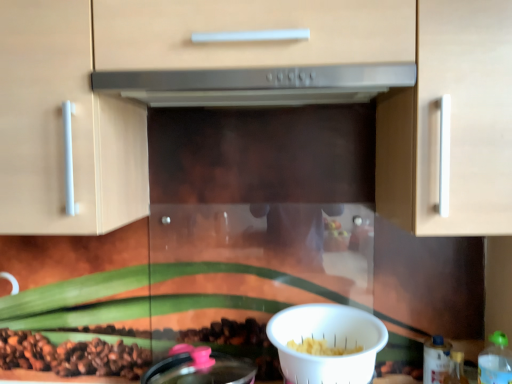
At what (x,y) coordinates should I click in order to perform the action: click on satin silver range hood at center. Please return your answer as a coordinate pair (x, y). The height and width of the screenshot is (384, 512). Looking at the image, I should click on (257, 85).

This screenshot has height=384, width=512. What are the coordinates of `translucent plastic bottle at lower right, placed as the second bottle when sorted from front to back` in the screenshot? It's located at (456, 369).

Is green plastic bottle at lower right, which is counted as the 1th bottle, starting from the front, positioned far away from satin silver range hood at center?

green plastic bottle at lower right, which is counted as the 1th bottle, starting from the front, is actually quite close to satin silver range hood at center.

Is point (498, 353) less distant than point (141, 94)?

That is False.

From the image's perspective, is green plastic bottle at lower right, which is counted as the 1th bottle, starting from the front, on top of satin silver range hood at center?

Actually, green plastic bottle at lower right, which is counted as the 1th bottle, starting from the front, appears below satin silver range hood at center in the image.

Can you see satin silver range hood at center touching translucent plastic bottle at lower right, which is counted as the second bottle, starting from the back?

No, satin silver range hood at center is not with translucent plastic bottle at lower right, which is counted as the second bottle, starting from the back.

From the satin silver range hood at center, count 2nd bottles backward and point to it. Please provide its 2D coordinates.

[(456, 369)]

Who is more distant, satin silver range hood at center or translucent plastic bottle at lower right, placed as the second bottle when sorted from front to back?

translucent plastic bottle at lower right, placed as the second bottle when sorted from front to back, is behind.

From a real-world perspective, relative to translucent plastic bottle at lower right, placed as the second bottle when sorted from front to back, is satin silver range hood at center vertically above or below?

In terms of real-world spatial position, satin silver range hood at center is above translucent plastic bottle at lower right, placed as the second bottle when sorted from front to back.

Does point (370, 86) come closer to viewer compared to point (291, 377)?

Yes.

Does satin silver range hood at center have a greater height compared to white plastic bowl at lower center?

Incorrect, the height of satin silver range hood at center is not larger of that of white plastic bowl at lower center.

Is satin silver range hood at center turned away from white plastic bowl at lower center?

No, white plastic bowl at lower center is not at the back of satin silver range hood at center.

Find the location of `cabinetry on the left of translucent plastic bottle at lower right, placed as the second bottle when sorted from front to back`. cabinetry on the left of translucent plastic bottle at lower right, placed as the second bottle when sorted from front to back is located at coordinates (255, 66).

Which object is closer to the camera, translucent plastic bottle at lower right, which is counted as the second bottle, starting from the back, or matte wood cabinet at center?

matte wood cabinet at center is in front.

Consider the image. From the image's perspective, does translucent plastic bottle at lower right, placed as the second bottle when sorted from front to back, appear higher than matte wood cabinet at center?

No.

Can you tell me how much translucent plastic bottle at lower right, placed as the second bottle when sorted from front to back, and matte wood cabinet at center differ in facing direction?

The angular difference between translucent plastic bottle at lower right, placed as the second bottle when sorted from front to back, and matte wood cabinet at center is 1.93 degrees.

From the image's perspective, who appears lower, matte wood cabinet at center or translucent plastic bottle at lower right, which is counted as the second bottle, starting from the back?

translucent plastic bottle at lower right, which is counted as the second bottle, starting from the back.

Is matte wood cabinet at center aimed at translucent plastic bottle at lower right, placed as the second bottle when sorted from front to back?

No, matte wood cabinet at center is not turned towards translucent plastic bottle at lower right, placed as the second bottle when sorted from front to back.

Between point (1, 111) and point (454, 378), which one is positioned in front?

The point (1, 111) is in front.

Is matte wood cabinet at center wider than translucent plastic bottle at lower right, which is counted as the second bottle, starting from the back?

Yes.

From the image's perspective, is matte wood cabinet at center beneath satin silver range hood at center?

Correct, matte wood cabinet at center appears lower than satin silver range hood at center in the image.

Would you consider matte wood cabinet at center to be distant from satin silver range hood at center?

No.

Considering the positions of objects matte wood cabinet at center and satin silver range hood at center in the image provided, who is behind, matte wood cabinet at center or satin silver range hood at center?

satin silver range hood at center.

Is matte wood cabinet at center facing away from satin silver range hood at center?

Yes.

Does white plastic bowl at lower center turn towards satin silver range hood at center?

No, white plastic bowl at lower center does not turn towards satin silver range hood at center.

Identify the location of bowl on the right of satin silver range hood at center. This screenshot has height=384, width=512. (327, 343).

Considering the positions of points (288, 377) and (224, 105), is point (288, 377) closer to camera compared to point (224, 105)?

Yes, it is in front of point (224, 105).

From a real-world perspective, is white plastic bowl at lower center positioned over satin silver range hood at center based on gravity?

No, from a real-world perspective, white plastic bowl at lower center is not over satin silver range hood at center

The width and height of the screenshot is (512, 384). Find the location of `home appliance above the green plastic bottle at lower right, which is the third bottle in back-to-front order (from a real-world perspective)`. home appliance above the green plastic bottle at lower right, which is the third bottle in back-to-front order (from a real-world perspective) is located at coordinates (257, 85).

From a real-world perspective, starting from the satin silver range hood at center, which bottle is the 2nd one below it? Please provide its 2D coordinates.

[(456, 369)]

Estimate the real-world distances between objects in this image. Which object is further from matte wood cabinet at center, translucent plastic bottle at lower right, acting as the 1th bottle starting from the back, or satin silver range hood at center?

translucent plastic bottle at lower right, acting as the 1th bottle starting from the back, lies further to matte wood cabinet at center than the other object.

Considering their positions, is translucent plastic bottle at lower right, which is the third bottle from front to back, positioned closer to green plastic bottle at lower right, which is counted as the 1th bottle, starting from the front, than white plastic bowl at lower center?

translucent plastic bottle at lower right, which is the third bottle from front to back, is closer to green plastic bottle at lower right, which is counted as the 1th bottle, starting from the front.

Based on the photo, looking at the image, which one is located further to translucent plastic bottle at lower right, which is the third bottle from front to back, matte wood cabinet at center or white plastic bowl at lower center?

Among the two, matte wood cabinet at center is located further to translucent plastic bottle at lower right, which is the third bottle from front to back.

Which object lies further to the anchor point white plastic bowl at lower center, matte wood cabinet at center or translucent plastic bottle at lower right, acting as the 1th bottle starting from the back?

Among the two, matte wood cabinet at center is located further to white plastic bowl at lower center.

Based on the photo, considering their positions, is green plastic bottle at lower right, which is the third bottle in back-to-front order, positioned further to translucent plastic bottle at lower right, which is the third bottle from front to back, than matte wood cabinet at center?

Based on the image, matte wood cabinet at center appears to be further to translucent plastic bottle at lower right, which is the third bottle from front to back.

Considering their positions, is translucent plastic bottle at lower right, which is the third bottle from front to back, positioned further to green plastic bottle at lower right, which is the third bottle in back-to-front order, than matte wood cabinet at center?

matte wood cabinet at center lies further to green plastic bottle at lower right, which is the third bottle in back-to-front order, than the other object.

Estimate the real-world distances between objects in this image. Which object is further from translucent plastic bottle at lower right, placed as the second bottle when sorted from front to back, translucent plastic bottle at lower right, which is the third bottle from front to back, or green plastic bottle at lower right, which is counted as the 1th bottle, starting from the front?

Based on the image, green plastic bottle at lower right, which is counted as the 1th bottle, starting from the front, appears to be further to translucent plastic bottle at lower right, placed as the second bottle when sorted from front to back.

From the image, which object appears to be farther from white plastic bowl at lower center, matte wood cabinet at center or satin silver range hood at center?

Based on the image, satin silver range hood at center appears to be further to white plastic bowl at lower center.

At what (x,y) coordinates should I click in order to perform the action: click on cabinetry between satin silver range hood at center and translucent plastic bottle at lower right, which is the third bottle from front to back, in the vertical direction. Please return your answer as a coordinate pair (x, y). Looking at the image, I should click on point(255,66).

Find the location of a particular element. This screenshot has width=512, height=384. bowl between satin silver range hood at center and green plastic bottle at lower right, which is counted as the 1th bottle, starting from the front, from top to bottom is located at coordinates (327, 343).

Locate an element on the screen. The width and height of the screenshot is (512, 384). bowl between matte wood cabinet at center and translucent plastic bottle at lower right, placed as the second bottle when sorted from front to back, vertically is located at coordinates (327, 343).

Image resolution: width=512 pixels, height=384 pixels. I want to click on cabinetry between satin silver range hood at center and green plastic bottle at lower right, which is counted as the 1th bottle, starting from the front, from top to bottom, so click(x=255, y=66).